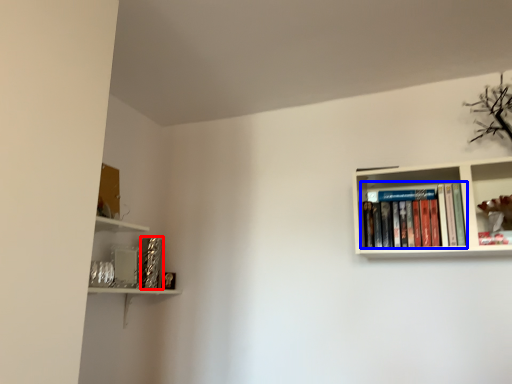
Question: Among these objects, which one is nearest to the camera, paperback book (highlighted by a red box) or book (highlighted by a blue box)?

Choices:
 (A) paperback book
 (B) book

Answer: (B)